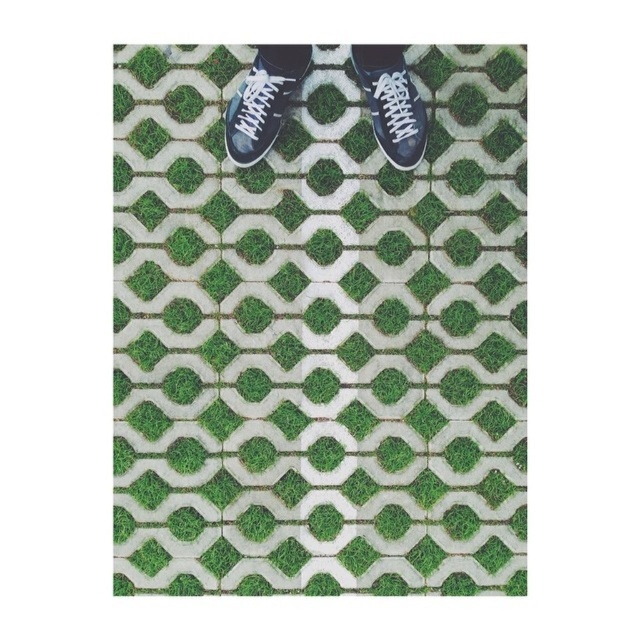
Question: Considering the real-world distances, which object is closest to the green grass at center?

Choices:
 (A) matte black sneaker at upper right
 (B) black leather shoe at center

Answer: (B)

Question: Which point appears farthest from the camera in this image?

Choices:
 (A) (387, 77)
 (B) (488, 195)
 (C) (262, 93)

Answer: (B)

Question: In this image, where is green grass at center located relative to matte black sneaker at upper right?

Choices:
 (A) left
 (B) right

Answer: (A)

Question: Can you confirm if black leather shoe at center is wider than matte black sneaker at upper right?

Choices:
 (A) yes
 (B) no

Answer: (A)

Question: Can you confirm if green grass at center is positioned below black leather shoe at center?

Choices:
 (A) no
 (B) yes

Answer: (B)

Question: Among these points, which one is farthest from the camera?

Choices:
 (A) (419, 144)
 (B) (294, 129)
 (C) (278, 131)

Answer: (B)